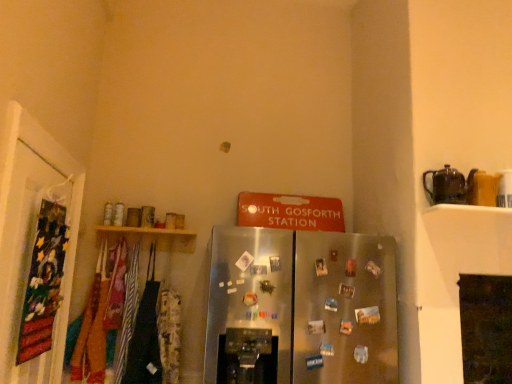
Describe the element at coordinates (153, 237) in the screenshot. I see `wooden shelf at upper left` at that location.

What do you see at coordinates (33, 238) in the screenshot? I see `velvet fabric banner at left` at bounding box center [33, 238].

Where is `wooden shelf at upper left`? wooden shelf at upper left is located at coordinates (153, 237).

How many degrees apart are the facing directions of wooden shelf at upper left and satin silver refrigerator at center?

There is a 0.478-degree angle between the facing directions of wooden shelf at upper left and satin silver refrigerator at center.

Choose the correct answer: Is wooden shelf at upper left inside satin silver refrigerator at center or outside it?

wooden shelf at upper left is located beyond the bounds of satin silver refrigerator at center.

From a real-world perspective, is wooden shelf at upper left over satin silver refrigerator at center?

Indeed, from a real-world perspective, wooden shelf at upper left stands above satin silver refrigerator at center.

Is wooden shelf at upper left far from satin silver refrigerator at center?

They are positioned close to each other.

Is brown ceramic teapot at upper right smaller than velvet fabric banner at left?

Indeed, brown ceramic teapot at upper right has a smaller size compared to velvet fabric banner at left.

Is velvet fabric banner at left surrounded by brown ceramic teapot at upper right?

No, velvet fabric banner at left is not a part of brown ceramic teapot at upper right.

From the image's perspective, is brown ceramic teapot at upper right below velvet fabric banner at left?

No, from the image's perspective, brown ceramic teapot at upper right is not beneath velvet fabric banner at left.

Is brown ceramic teapot at upper right positioned with its back to velvet fabric banner at left?

No, brown ceramic teapot at upper right is not facing away from velvet fabric banner at left.

Considering the positions of point (67, 179) and point (457, 196), is point (67, 179) closer or farther from the camera than point (457, 196)?

Point (67, 179).

Can you tell me how much velvet fabric banner at left and brown ceramic teapot at upper right differ in facing direction?

90.2 degrees.

How much distance is there between velvet fabric banner at left and brown ceramic teapot at upper right?

A distance of 1.87 meters exists between velvet fabric banner at left and brown ceramic teapot at upper right.

Is velvet fabric banner at left directly adjacent to brown ceramic teapot at upper right?

No, velvet fabric banner at left is not with brown ceramic teapot at upper right.

Is point (159, 237) positioned before point (455, 171)?

No, (159, 237) is behind (455, 171).

Can you confirm if wooden shelf at upper left is smaller than brown ceramic teapot at upper right?

No, wooden shelf at upper left is not smaller than brown ceramic teapot at upper right.

Does wooden shelf at upper left turn towards brown ceramic teapot at upper right?

No, wooden shelf at upper left does not turn towards brown ceramic teapot at upper right.

Consider the image. From a real-world perspective, which is physically above, wooden shelf at upper left or brown ceramic teapot at upper right?

In real-world perspective, brown ceramic teapot at upper right is above.

Based on the photo, how much distance is there between brown ceramic teapot at upper right and wooden shelf at upper left?

brown ceramic teapot at upper right is 5.11 feet away from wooden shelf at upper left.

Is brown ceramic teapot at upper right far from wooden shelf at upper left?

brown ceramic teapot at upper right is far away from wooden shelf at upper left.

Can you tell me how much brown ceramic teapot at upper right and wooden shelf at upper left differ in facing direction?

The angular difference between brown ceramic teapot at upper right and wooden shelf at upper left is 0.606 degrees.

Can we say brown ceramic teapot at upper right lies outside wooden shelf at upper left?

Yes, brown ceramic teapot at upper right is not within wooden shelf at upper left.

Are satin silver refrigerator at center and wooden shelf at upper left far apart?

They are positioned close to each other.

Is satin silver refrigerator at center facing away from wooden shelf at upper left?

No.

Is satin silver refrigerator at center shorter than wooden shelf at upper left?

In fact, satin silver refrigerator at center may be taller than wooden shelf at upper left.

From the image's perspective, which is above, satin silver refrigerator at center or wooden shelf at upper left?

wooden shelf at upper left is shown above in the image.

Considering the relative sizes of brown ceramic teapot at upper right and satin silver refrigerator at center in the image provided, is brown ceramic teapot at upper right taller than satin silver refrigerator at center?

Incorrect, the height of brown ceramic teapot at upper right is not larger of that of satin silver refrigerator at center.

Looking at the image, does brown ceramic teapot at upper right seem bigger or smaller compared to satin silver refrigerator at center?

In the image, brown ceramic teapot at upper right appears to be smaller than satin silver refrigerator at center.

From a real-world perspective, between brown ceramic teapot at upper right and satin silver refrigerator at center, who is vertically higher?

brown ceramic teapot at upper right.

Considering the positions of objects brown ceramic teapot at upper right and satin silver refrigerator at center in the image provided, who is more to the right, brown ceramic teapot at upper right or satin silver refrigerator at center?

Positioned to the right is brown ceramic teapot at upper right.

Where is `refrigerator on the right of wooden shelf at upper left`? refrigerator on the right of wooden shelf at upper left is located at coordinates (301, 308).

The width and height of the screenshot is (512, 384). Find the location of `door that appears in front of the brown ceramic teapot at upper right`. door that appears in front of the brown ceramic teapot at upper right is located at coordinates (33, 238).

Which object lies nearer to the anchor point velvet fabric banner at left, satin silver refrigerator at center or wooden shelf at upper left?

Among the two, wooden shelf at upper left is located nearer to velvet fabric banner at left.

Considering their positions, is wooden shelf at upper left positioned further to velvet fabric banner at left than satin silver refrigerator at center?

satin silver refrigerator at center is positioned further to the anchor velvet fabric banner at left.

Based on their spatial positions, is velvet fabric banner at left or brown ceramic teapot at upper right further from wooden shelf at upper left?

brown ceramic teapot at upper right is positioned further to the anchor wooden shelf at upper left.

Based on their spatial positions, is satin silver refrigerator at center or brown ceramic teapot at upper right further from wooden shelf at upper left?

The object further to wooden shelf at upper left is brown ceramic teapot at upper right.

From the picture: Looking at the image, which one is located closer to satin silver refrigerator at center, velvet fabric banner at left or brown ceramic teapot at upper right?

brown ceramic teapot at upper right.

Looking at this image, based on their spatial positions, is wooden shelf at upper left or velvet fabric banner at left further from satin silver refrigerator at center?

Among the two, velvet fabric banner at left is located further to satin silver refrigerator at center.

Considering their positions, is satin silver refrigerator at center positioned further to velvet fabric banner at left than brown ceramic teapot at upper right?

brown ceramic teapot at upper right.

Looking at the image, which one is located closer to satin silver refrigerator at center, brown ceramic teapot at upper right or wooden shelf at upper left?

brown ceramic teapot at upper right.

This screenshot has height=384, width=512. Find the location of `shelf between velvet fabric banner at left and satin silver refrigerator at center from left to right`. shelf between velvet fabric banner at left and satin silver refrigerator at center from left to right is located at coordinates (153, 237).

The height and width of the screenshot is (384, 512). Find the location of `refrigerator situated between wooden shelf at upper left and brown ceramic teapot at upper right from left to right`. refrigerator situated between wooden shelf at upper left and brown ceramic teapot at upper right from left to right is located at coordinates (301, 308).

Find the location of a particular element. This screenshot has height=384, width=512. refrigerator between velvet fabric banner at left and brown ceramic teapot at upper right in the horizontal direction is located at coordinates (301, 308).

What are the coordinates of `shelf between velvet fabric banner at left and brown ceramic teapot at upper right from left to right` in the screenshot? It's located at (153, 237).